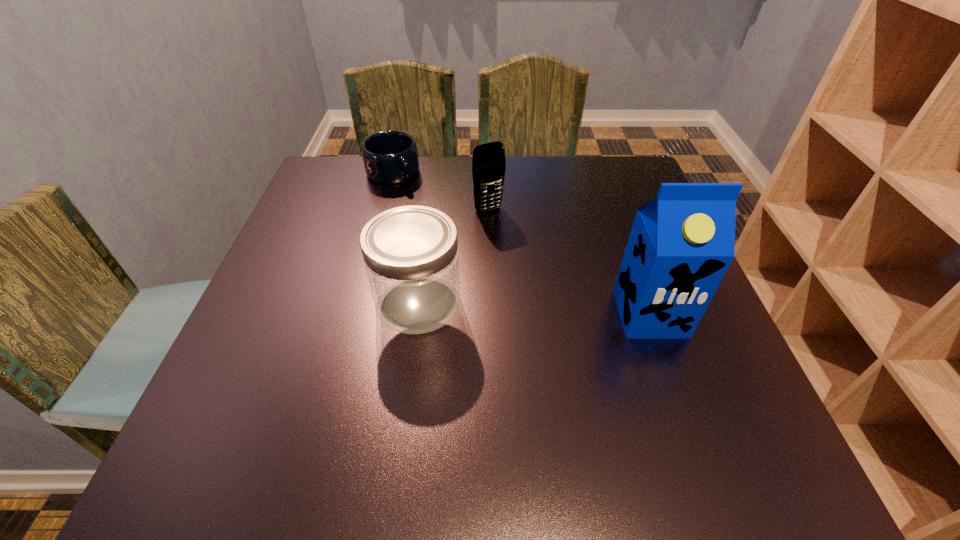
Where is `free spot located 0.170m on the screen of the cellular telephone`? This screenshot has height=540, width=960. free spot located 0.170m on the screen of the cellular telephone is located at coordinates pos(526,258).

Find the location of a particular element. The image size is (960, 540). free space located on the screen of the cellular telephone is located at coordinates (544, 281).

You are a GUI agent. You are given a task and a screenshot of the screen. Output one action in this format:
    pyautogui.click(x=<x>, y=<y>)
    Task: Click on the blank space located 0.200m with the handle on the side of the shortest object
    
    Given the screenshot: What is the action you would take?
    pyautogui.click(x=443, y=225)

Locate an element on the screen. Image resolution: width=960 pixels, height=540 pixels. vacant area located 0.330m with the handle on the side of the shortest object is located at coordinates (471, 255).

This screenshot has width=960, height=540. Identify the location of free space located with the handle on the side of the shortest object. (420, 202).

Where is `cellular telephone present at the far edge`? cellular telephone present at the far edge is located at coordinates (488, 161).

This screenshot has height=540, width=960. In order to click on mug at the far edge in this screenshot , I will do `click(390, 157)`.

Find the location of a particular element. This screenshot has height=540, width=960. object at the left edge is located at coordinates (390, 157).

This screenshot has width=960, height=540. I want to click on object present at the right edge, so click(x=681, y=244).

Find the location of a particular element. object that is at the far left corner is located at coordinates (390, 157).